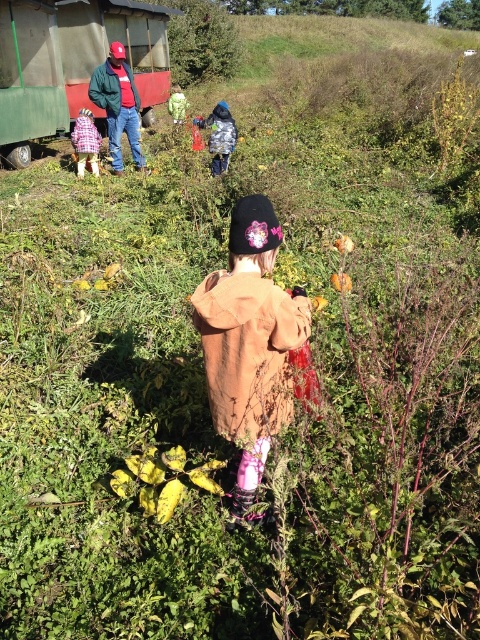
You are a photographer trying to capture a photo of the plaid fabric coat at center and the green weathered train car at upper left. Which object should you focus on first if you want to ensure both are in the frame without moving the camera?

You should focus on the green weathered train car at upper left first because it is larger than the plaid fabric coat at center, making it easier to frame properly before adjusting for the smaller object.

You are a photographer trying to capture two coats in the scene. The fuzzy brown coat at center and the plaid fabric coat at center. Which coat would you focus on first if you want to ensure both are in sharp focus, considering their sizes?

The fuzzy brown coat at center is thinner than the plaid fabric coat at center, so you should focus on the plaid fabric coat at center first to ensure both are in sharp focus since it is larger and might require more precise focusing.